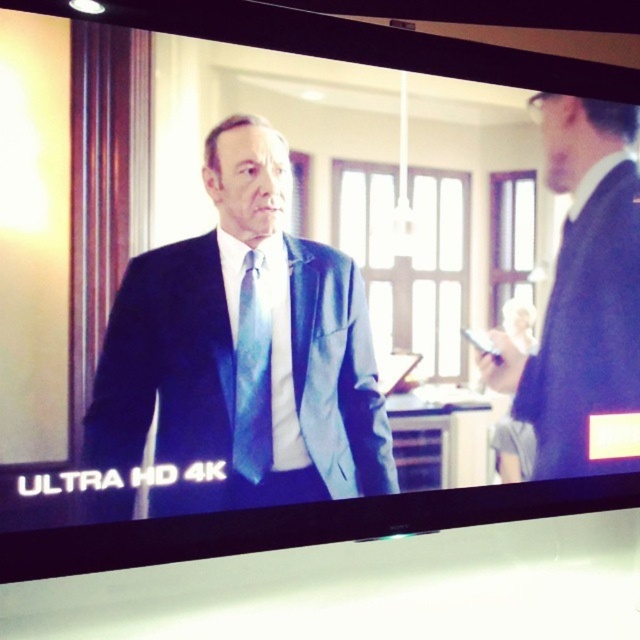
You are an actor preparing for a scene. You need to decide where to position yourself so that your height doesn not block the blue silk tie at center from the camera. Given that the satin black suit at right is taller, where should you stand?

Since the satin black suit at right is taller than the blue silk tie at center, you should position yourself closer to the satin black suit at right to avoid blocking the view of the blue silk tie at center.

You are a costume designer preparing for a play. You need to ensure that the costume pieces you have match the actor in the image. The actor is wearing the matte blue suit at center and the blue silk tie at center. Based on the description, will the tie fit properly with the suit?

The matte blue suit at center is much taller as blue silk tie at center. Therefore, the blue silk tie at center will fit properly with the matte blue suit at center since the tie is shorter and proportionate to the suit.

You are a costume designer reviewing a scene from a drama. You notice the satin black suit at right and the blue silk tie at center. According to the scene, which item is positioned higher in the frame?

The satin black suit at right is positioned higher in the frame than the blue silk tie at center because it is described as being above it.